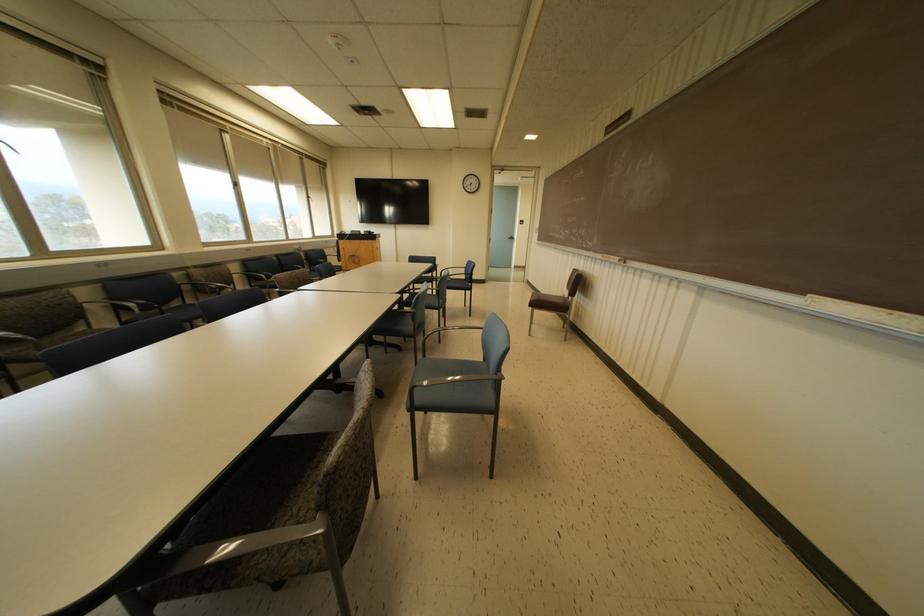
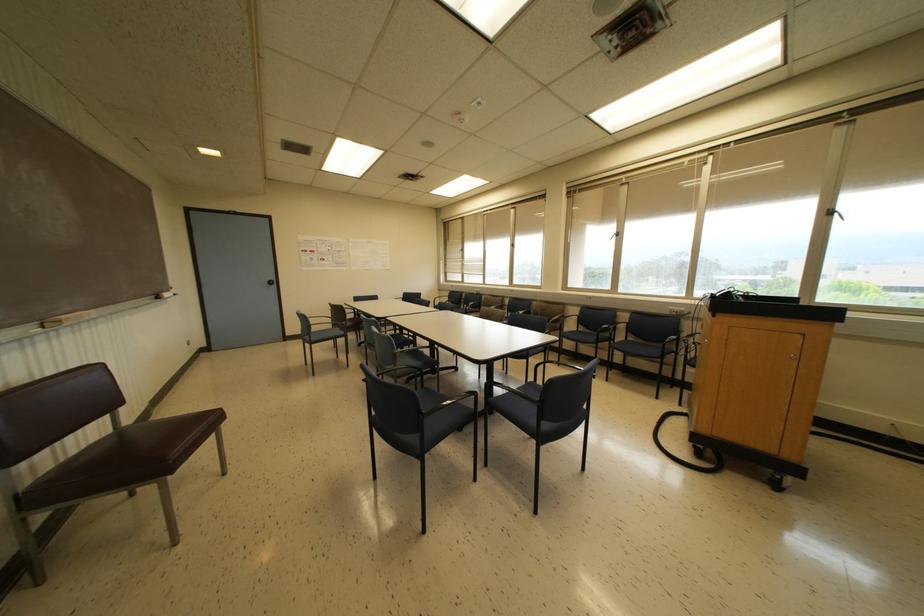
Find the pixel in the second image that matches the point at 308,197 in the first image.

(827, 213)